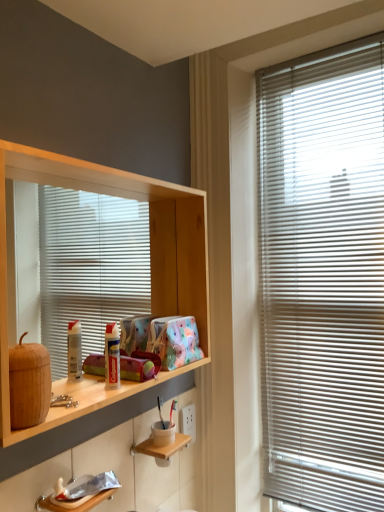
Question: From the image's perspective, is wooden shelf at left, arranged as the 2th shelf when ordered from the bottom, above or below wooden shelf at lower center, positioned as the first shelf in bottom-to-top order?

Choices:
 (A) above
 (B) below

Answer: (A)

Question: From a real-world perspective, relative to wooden shelf at lower center, positioned as the first shelf in bottom-to-top order, is wooden shelf at left, arranged as the 2th shelf when ordered from the bottom, vertically above or below?

Choices:
 (A) below
 (B) above

Answer: (B)

Question: Estimate the real-world distances between objects in this image. Which object is closer to the wooden shelf at left, arranged as the first shelf when viewed from the top?

Choices:
 (A) white plastic blinds at right
 (B) wooden shelf at lower center, which ranks as the 2th shelf in top-to-bottom order

Answer: (A)

Question: Considering the real-world distances, which object is closest to the white plastic blinds at right?

Choices:
 (A) wooden shelf at lower center, positioned as the first shelf in bottom-to-top order
 (B) wooden shelf at left, arranged as the first shelf when viewed from the top

Answer: (B)